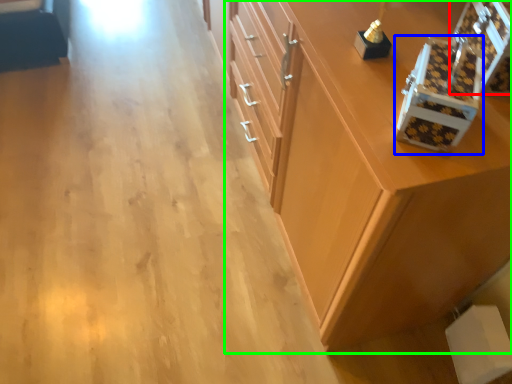
Question: Which is farther away from box (highlighted by a red box)? box (highlighted by a blue box) or cabinetry (highlighted by a green box)?

Choices:
 (A) box
 (B) cabinetry

Answer: (B)